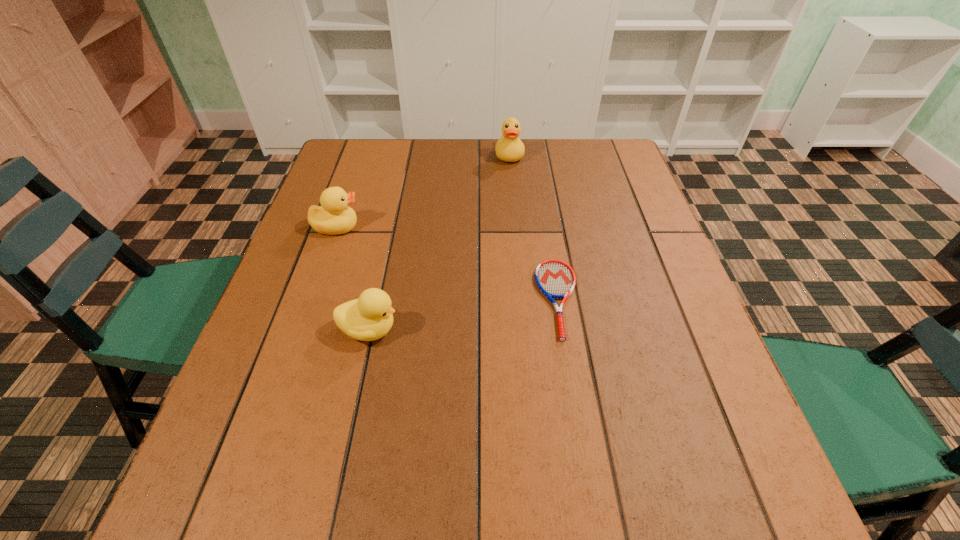
Where is `vacant point located between the nearest duck and the second farthest object`? Image resolution: width=960 pixels, height=540 pixels. vacant point located between the nearest duck and the second farthest object is located at coordinates (353, 279).

The height and width of the screenshot is (540, 960). I want to click on empty location between the farthest object and the leftmost object, so [x=423, y=191].

The height and width of the screenshot is (540, 960). Find the location of `empty location between the rightmost duck and the leftmost duck`. empty location between the rightmost duck and the leftmost duck is located at coordinates (423, 191).

In order to click on vacant space that's between the second object from left to right and the farthest object in this screenshot , I will do `click(440, 242)`.

What are the coordinates of `empty space between the tennis racket and the second nearest duck` in the screenshot? It's located at (447, 263).

Where is `vacant space in between the tennis racket and the second object from left to right`? vacant space in between the tennis racket and the second object from left to right is located at coordinates (464, 314).

Where is `the second closest object to the shortest object`? This screenshot has height=540, width=960. the second closest object to the shortest object is located at coordinates (509, 148).

Where is `object that stands as the closest to the second duck from left to right`? The width and height of the screenshot is (960, 540). object that stands as the closest to the second duck from left to right is located at coordinates (334, 216).

This screenshot has width=960, height=540. I want to click on the closest duck to the second farthest duck, so [x=370, y=317].

Choose which duck is the nearest neighbor to the third nearest object. Please provide its 2D coordinates. Your answer should be formatted as a tuple, i.e. [(x, y)], where the tuple contains the x and y coordinates of a point satisfying the conditions above.

[(370, 317)]